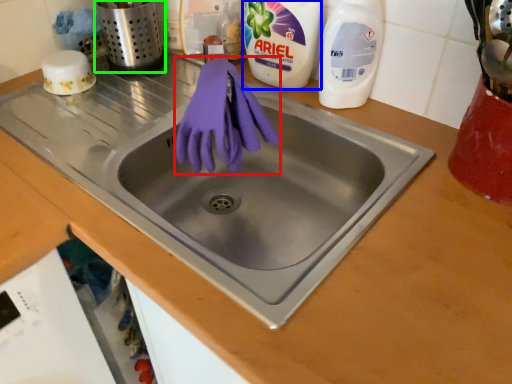
Question: Considering the real-world distances, which object is farthest from glove (highlighted by a red box)? cleaning product (highlighted by a blue box) or appliance (highlighted by a green box)?

Choices:
 (A) cleaning product
 (B) appliance

Answer: (B)